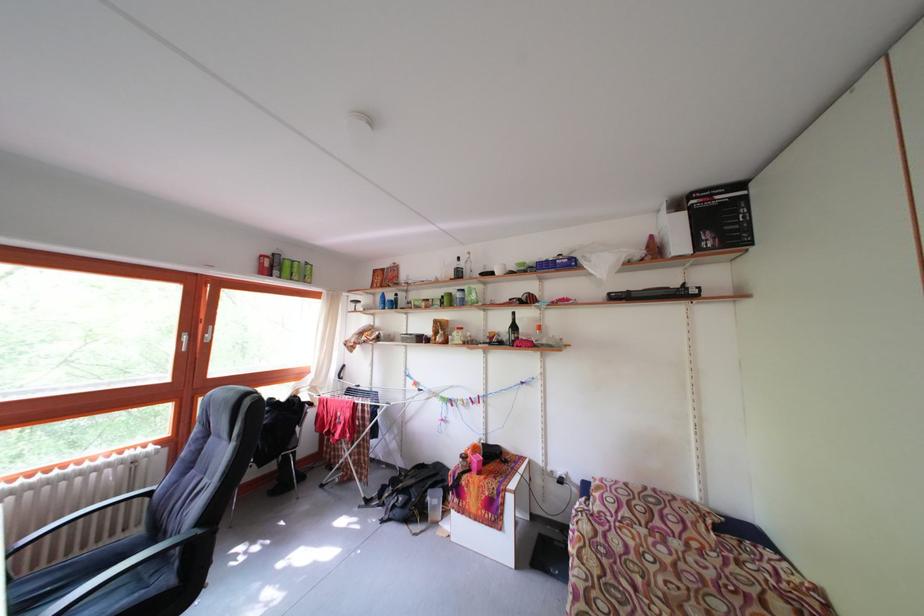
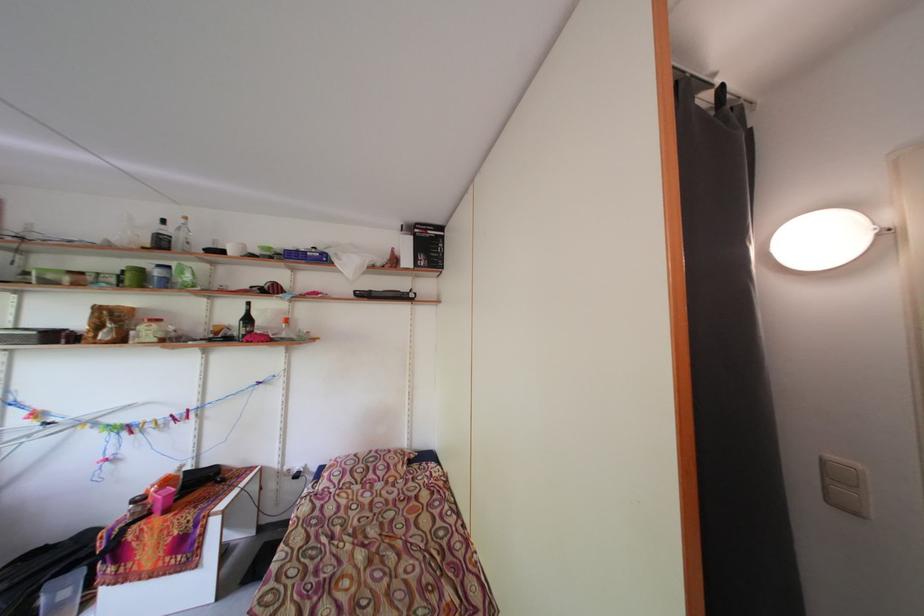
In the second image, find the point that corresponds to point (477, 467) in the first image.

(156, 508)